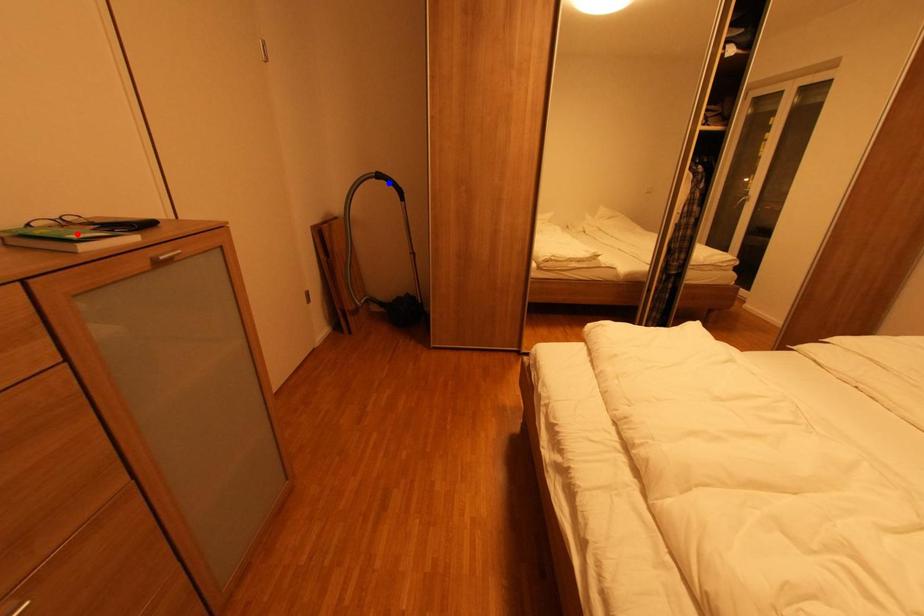
Question: Which of the two points in the image is closer to the camera?

Choices:
 (A) Blue point is closer.
 (B) Red point is closer.

Answer: (B)